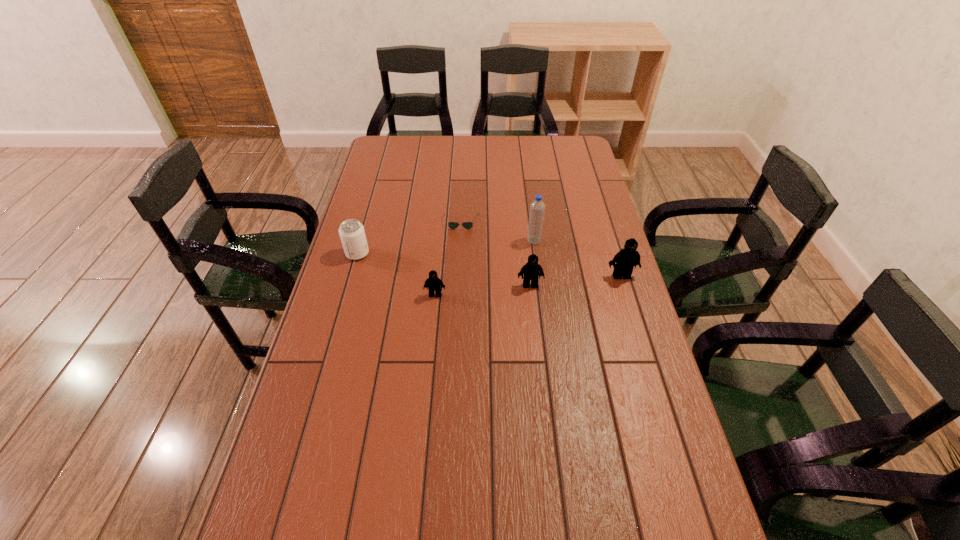
Where is `the nearest Lego`? This screenshot has height=540, width=960. the nearest Lego is located at coordinates (433, 283).

Where is `the leftmost Lego`? The image size is (960, 540). the leftmost Lego is located at coordinates (433, 283).

You are a GUI agent. You are given a task and a screenshot of the screen. Output one action in this format:
    pyautogui.click(x=<x>, y=<y>)
    Task: Click on the second nearest object
    The height and width of the screenshot is (540, 960).
    Given the screenshot: What is the action you would take?
    pyautogui.click(x=532, y=270)

This screenshot has height=540, width=960. What are the coordinates of `the second farthest Lego` in the screenshot? It's located at (532, 270).

This screenshot has width=960, height=540. Identify the location of the rightmost object. (624, 261).

At what (x,y) coordinates should I click in order to perform the action: click on the farthest Lego. Please return your answer as a coordinate pair (x, y). Image resolution: width=960 pixels, height=540 pixels. Looking at the image, I should click on (624, 261).

The width and height of the screenshot is (960, 540). I want to click on water bottle, so click(x=537, y=208).

This screenshot has height=540, width=960. Identify the location of the second farthest object. (537, 208).

Locate an element on the screen. soda can is located at coordinates (351, 231).

Locate an element on the screen. Image resolution: width=960 pixels, height=540 pixels. the fourth nearest object is located at coordinates (351, 231).